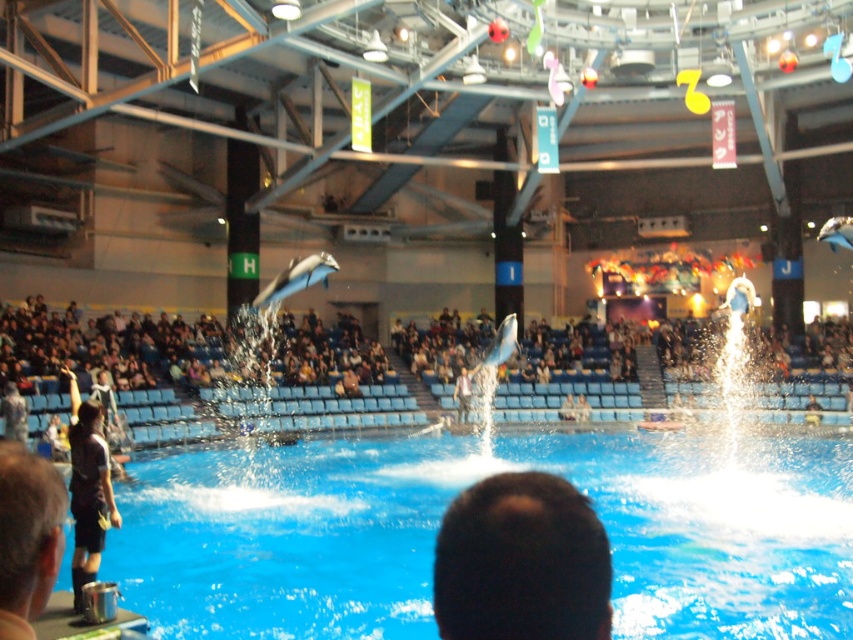
You are a photographer positioned at the edge of the pool in the dolphinarium. You want to capture a photo of the dark hair at center and the dark brown leather jacket at lower left in the same frame. Based on their sizes, can you fit both subjects into your camera viewfinder without zooming in?

The dark hair at center might be wider than dark brown leather jacket at lower left, so there is a possibility that both can fit into the camera viewfinder without zooming in, but it depends on their actual widths.

You are a photographer standing at the back of the blue seating areas. You want to capture a clear shot of the blue smooth water at center. Where should you aim your camera?

You should aim your camera at point (x=439, y=520) to capture the blue smooth water at center.

You are a photographer standing at the back of the venue. You want to take a photo of the dark hair at center and the dark brown leather jacket at lower left. Which object will appear larger in your photo?

The dark hair at center will appear larger in the photo because it is closer to the viewer than the dark brown leather jacket at lower left.